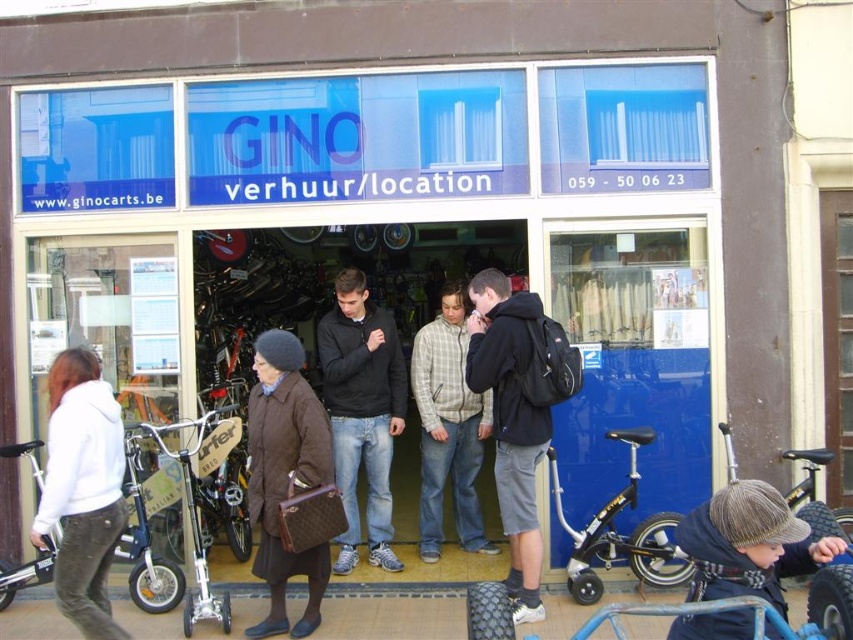
You are a customer entering the GINO verhuur location to rent a bike. As you look at the items displayed near the entrance, which object is taller between the brown quilted coat at center and the knitted woolen hat at lower right?

The brown quilted coat at center is taller than the knitted woolen hat at lower right.

You are standing outside the GINO verhuur setLocation storefront and notice a black matte jacket at center. Where exactly is the black matte jacket located in relation to the storefront?

The black matte jacket at center is located at point 0.644 on the x axis and 0.426 on the y axis.